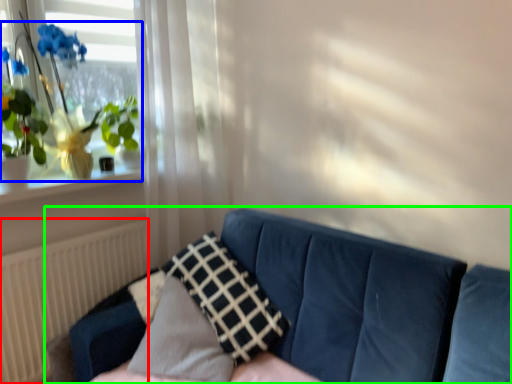
Question: Which object is the farthest from radiator (highlighted by a red box)? Choose among these: houseplant (highlighted by a blue box) or studio couch (highlighted by a green box).

Choices:
 (A) houseplant
 (B) studio couch

Answer: (B)